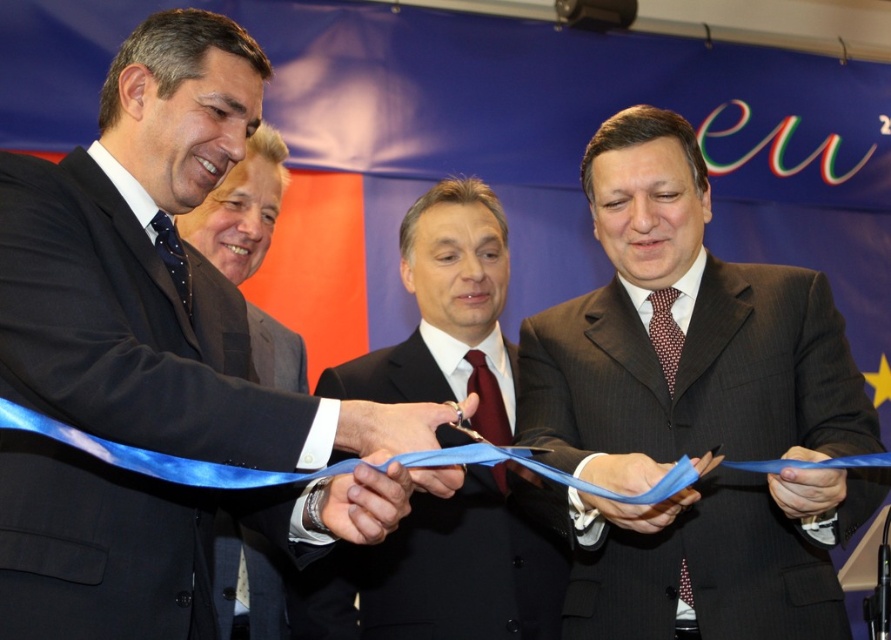
Question: Which of the following is the farthest from the observer?

Choices:
 (A) brushed metal suit at left
 (B) dark brown suit at center
 (C) satin blue ribbon at lower center

Answer: (A)

Question: Does dark brown suit at center have a smaller size compared to blue fabric ribbon at center?

Choices:
 (A) no
 (B) yes

Answer: (A)

Question: Is dark gray pinstripe suit at center thinner than blue fabric ribbon at lower center?

Choices:
 (A) no
 (B) yes

Answer: (A)

Question: Among these objects, which one is nearest to the camera?

Choices:
 (A) brushed metal suit at left
 (B) satin blue ribbon at lower center
 (C) dark gray pinstripe suit at center
 (D) dark brown suit at center

Answer: (B)

Question: Does dark brown suit at center have a greater width compared to black wool suit at left?

Choices:
 (A) no
 (B) yes

Answer: (B)

Question: Which point appears closest to the camera in this image?

Choices:
 (A) (437, 484)
 (B) (840, 481)
 (C) (617, 484)

Answer: (A)